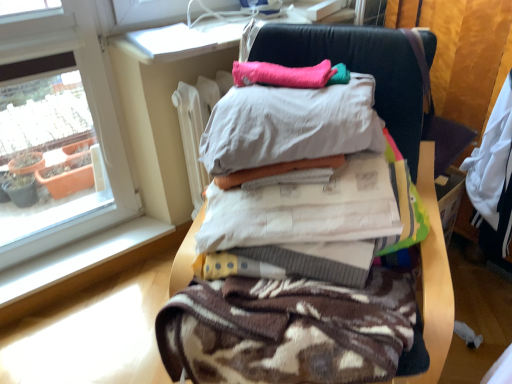
The image size is (512, 384). What do you see at coordinates (438, 118) in the screenshot?
I see `dark blue leather chair at right` at bounding box center [438, 118].

The width and height of the screenshot is (512, 384). I want to click on dark blue leather chair at right, so click(438, 118).

Is pink fabric pillow at upper center next to brown textured blanket at center?

They are not placed beside each other.

Considering the positions of point (302, 87) and point (362, 67), is point (302, 87) closer or farther from the camera than point (362, 67)?

Clearly, point (302, 87) is closer to the camera than point (362, 67).

From the image's perspective, is pink fabric pillow at upper center positioned above or below brown textured blanket at center?

pink fabric pillow at upper center is above brown textured blanket at center.

Considering the sizes of objects pink fabric pillow at upper center and brown textured blanket at center in the image provided, who is bigger, pink fabric pillow at upper center or brown textured blanket at center?

Bigger between the two is brown textured blanket at center.

Does brown textured blanket at center turn towards brown textured blanket at center?

Yes, brown textured blanket at center faces towards brown textured blanket at center.

Where is `furniture that appears above the brown textured blanket at center (from a real-world perspective)`? The image size is (512, 384). furniture that appears above the brown textured blanket at center (from a real-world perspective) is located at coordinates point(432,280).

Between brown textured blanket at center and brown textured blanket at center, which one has larger size?

brown textured blanket at center is bigger.

Does brown textured blanket at center have a greater height compared to brown textured blanket at center?

Yes.

In terms of height, does brown textured blanket at center look taller or shorter compared to pink fabric pillow at upper center?

Clearly, brown textured blanket at center is taller compared to pink fabric pillow at upper center.

Is point (326, 354) closer to camera compared to point (234, 70)?

Yes, point (326, 354) is closer to viewer.

Choose the correct answer: Is brown textured blanket at center inside pink fabric pillow at upper center or outside it?

brown textured blanket at center is not enclosed by pink fabric pillow at upper center.

From the image's perspective, is brown textured blanket at center on top of pink fabric pillow at upper center?

No, from the image's perspective, brown textured blanket at center is not over pink fabric pillow at upper center.

Considering the sizes of objects dark blue leather chair at right and brown textured blanket at center in the image provided, who is bigger, dark blue leather chair at right or brown textured blanket at center?

brown textured blanket at center.

Which of these two, dark blue leather chair at right or brown textured blanket at center, is thinner?

dark blue leather chair at right.

Is brown textured blanket at center completely or partially inside dark blue leather chair at right?

No, brown textured blanket at center is located outside of dark blue leather chair at right.

The image size is (512, 384). I want to click on furniture that is below the dark blue leather chair at right (from the image's perspective), so click(x=432, y=280).

Locate an element on the screen. This screenshot has height=384, width=512. pillow above the dark blue leather chair at right (from the image's perspective) is located at coordinates (283, 75).

Is dark blue leather chair at right at the back of pink fabric pillow at upper center?

No, dark blue leather chair at right is not at the back of pink fabric pillow at upper center.

Based on the photo, in terms of height, does pink fabric pillow at upper center look taller or shorter compared to dark blue leather chair at right?

Clearly, pink fabric pillow at upper center is shorter compared to dark blue leather chair at right.

Considering the positions of objects pink fabric pillow at upper center and dark blue leather chair at right in the image provided, who is behind, pink fabric pillow at upper center or dark blue leather chair at right?

dark blue leather chair at right.

Where is `computer chair above the brown textured blanket at center (from the image's perspective)`? Image resolution: width=512 pixels, height=384 pixels. computer chair above the brown textured blanket at center (from the image's perspective) is located at coordinates (438, 118).

From the image's perspective, between dark blue leather chair at right and brown textured blanket at center, who is located below?

brown textured blanket at center appears lower in the image.

Considering the relative positions of dark blue leather chair at right and brown textured blanket at center in the image provided, is dark blue leather chair at right behind brown textured blanket at center?

Yes, dark blue leather chair at right is further from the viewer.

Which is less distant, (409, 31) or (387, 340)?

Clearly, point (409, 31) is more distant from the camera than point (387, 340).

Is dark blue leather chair at right bigger than pink fabric pillow at upper center?

Yes, dark blue leather chair at right is bigger than pink fabric pillow at upper center.

Considering the sizes of objects dark blue leather chair at right and pink fabric pillow at upper center in the image provided, who is thinner, dark blue leather chair at right or pink fabric pillow at upper center?

dark blue leather chair at right is thinner.

From the image's perspective, is dark blue leather chair at right beneath pink fabric pillow at upper center?

Correct, dark blue leather chair at right appears lower than pink fabric pillow at upper center in the image.

From a real-world perspective, who is located higher, dark blue leather chair at right or pink fabric pillow at upper center?

From a 3D spatial view, pink fabric pillow at upper center is above.

This screenshot has width=512, height=384. In order to click on furniture to the right of pink fabric pillow at upper center in this screenshot , I will do `click(432, 280)`.

Identify the location of furniture above the brown textured blanket at center (from a real-world perspective). (432, 280).

Considering their positions, is dark blue leather chair at right positioned further to brown textured blanket at center than brown textured blanket at center?

Among the two, brown textured blanket at center is located further to brown textured blanket at center.

Considering their positions, is brown textured blanket at center positioned further to dark blue leather chair at right than pink fabric pillow at upper center?

Based on the image, brown textured blanket at center appears to be further to dark blue leather chair at right.

Based on their spatial positions, is dark blue leather chair at right or pink fabric pillow at upper center closer to brown textured blanket at center?

The object closer to brown textured blanket at center is dark blue leather chair at right.

Looking at the image, which one is located further to brown textured blanket at center, brown textured blanket at center or dark blue leather chair at right?

The object further to brown textured blanket at center is dark blue leather chair at right.

Which object lies nearer to the anchor point brown textured blanket at center, pink fabric pillow at upper center or dark blue leather chair at right?

pink fabric pillow at upper center is positioned closer to the anchor brown textured blanket at center.

Which object lies further to the anchor point pink fabric pillow at upper center, brown textured blanket at center or brown textured blanket at center?

Among the two, brown textured blanket at center is located further to pink fabric pillow at upper center.

When comparing their distances from dark blue leather chair at right, does brown textured blanket at center or pink fabric pillow at upper center seem closer?

brown textured blanket at center lies closer to dark blue leather chair at right than the other object.

Looking at the image, which one is located further to pink fabric pillow at upper center, brown textured blanket at center or dark blue leather chair at right?

Based on the image, brown textured blanket at center appears to be further to pink fabric pillow at upper center.

Locate an element on the screen. Image resolution: width=512 pixels, height=384 pixels. computer chair between pink fabric pillow at upper center and brown textured blanket at center vertically is located at coordinates (438, 118).

In order to click on furniture between pink fabric pillow at upper center and brown textured blanket at center from top to bottom in this screenshot , I will do `click(432, 280)`.

Identify the location of furniture between dark blue leather chair at right and brown textured blanket at center in the vertical direction. This screenshot has width=512, height=384. (432, 280).

Where is `pillow between brown textured blanket at center and dark blue leather chair at right in the front-back direction`? This screenshot has width=512, height=384. pillow between brown textured blanket at center and dark blue leather chair at right in the front-back direction is located at coordinates (283, 75).